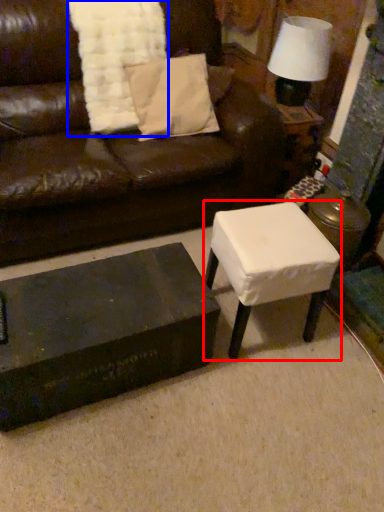
Question: Which point is further to the camera, table (highlighted by a red box) or blanket (highlighted by a blue box)?

Choices:
 (A) table
 (B) blanket

Answer: (B)